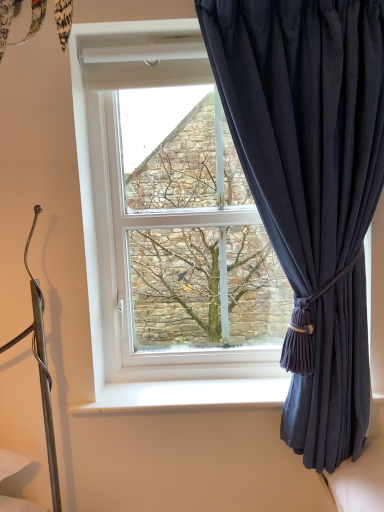
Question: Is white plastic window sill at lower center outside of dark blue fabric curtain at right?

Choices:
 (A) yes
 (B) no

Answer: (A)

Question: From the image's perspective, would you say white plastic window sill at lower center is shown under dark blue fabric curtain at right?

Choices:
 (A) no
 (B) yes

Answer: (B)

Question: From a real-world perspective, is white plastic window sill at lower center on top of dark blue fabric curtain at right?

Choices:
 (A) no
 (B) yes

Answer: (A)

Question: From a real-world perspective, is white plastic window sill at lower center below dark blue fabric curtain at right?

Choices:
 (A) no
 (B) yes

Answer: (B)

Question: From the image's perspective, is white plastic window sill at lower center over dark blue fabric curtain at right?

Choices:
 (A) no
 (B) yes

Answer: (A)

Question: From the image's perspective, is dark blue fabric curtain at right above or below green textured tree at center?

Choices:
 (A) below
 (B) above

Answer: (A)

Question: Considering the positions of dark blue fabric curtain at right and green textured tree at center in the image, is dark blue fabric curtain at right taller or shorter than green textured tree at center?

Choices:
 (A) short
 (B) tall

Answer: (B)

Question: Considering the positions of point (337, 395) and point (198, 233), is point (337, 395) closer or farther from the camera than point (198, 233)?

Choices:
 (A) farther
 (B) closer

Answer: (B)

Question: Is dark blue fabric curtain at right wider or thinner than green textured tree at center?

Choices:
 (A) thin
 (B) wide

Answer: (B)

Question: Looking at their shapes, would you say white plastic window sill at lower center is wider or thinner than green textured tree at center?

Choices:
 (A) wide
 (B) thin

Answer: (A)

Question: Considering the positions of point (258, 381) and point (193, 144), is point (258, 381) closer or farther from the camera than point (193, 144)?

Choices:
 (A) farther
 (B) closer

Answer: (B)

Question: Is white plastic window sill at lower center in front of or behind green textured tree at center in the image?

Choices:
 (A) front
 (B) behind

Answer: (B)

Question: Choose the correct answer: Is white plastic window sill at lower center inside green textured tree at center or outside it?

Choices:
 (A) outside
 (B) inside

Answer: (A)

Question: In the image, is green textured tree at center on the left side or the right side of white plastic window sill at lower center?

Choices:
 (A) left
 (B) right

Answer: (A)

Question: From a real-world perspective, is green textured tree at center positioned above or below white plastic window sill at lower center?

Choices:
 (A) above
 (B) below

Answer: (A)